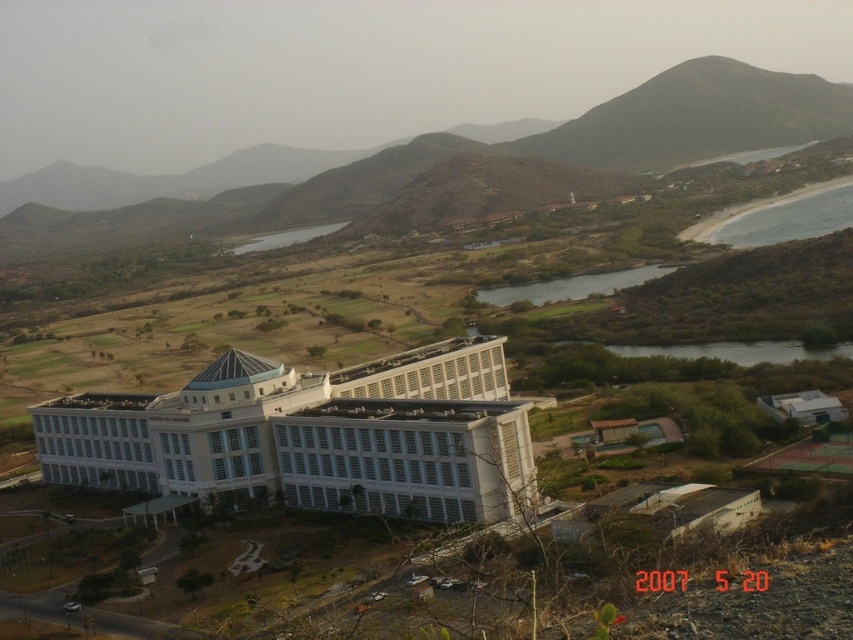
Does white glass building at center have a greater height compared to gray sand beach at lower right?

No.

Between white glass building at center and gray sand beach at lower right, which one has more height?

gray sand beach at lower right is taller.

Is point (178, 440) positioned behind point (747, 211)?

No, (178, 440) is closer to viewer.

Where is `white glass building at center`? Image resolution: width=853 pixels, height=640 pixels. white glass building at center is located at coordinates (311, 436).